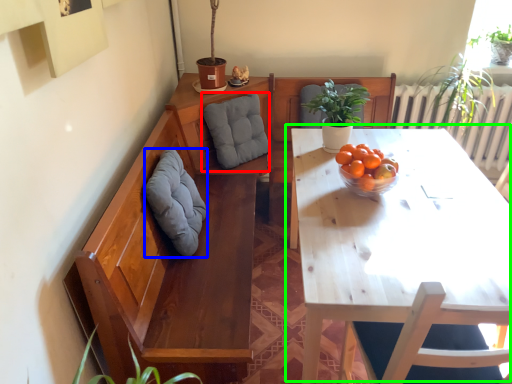
Question: Which is nearer to the gray (highlighted by a red box)? gray (highlighted by a blue box) or table (highlighted by a green box).

Choices:
 (A) gray
 (B) table

Answer: (A)